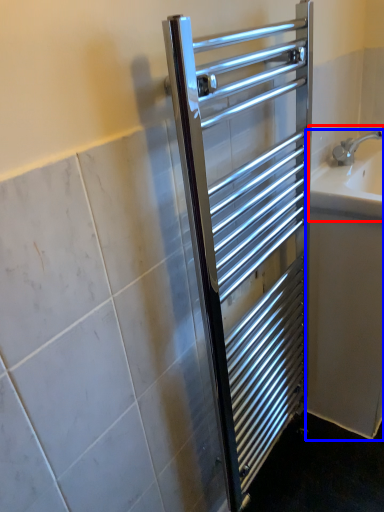
Question: Which of the following is the closest to the observer, sink (highlighted by a red box) or bath (highlighted by a blue box)?

Choices:
 (A) sink
 (B) bath

Answer: (A)